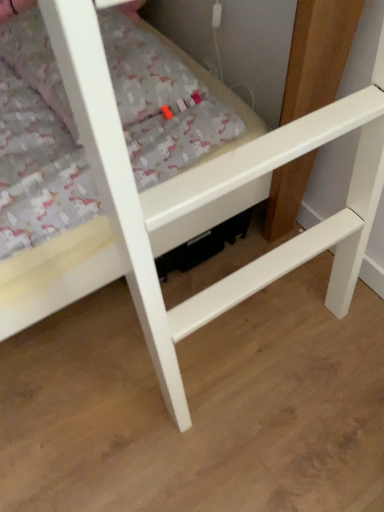
At what (x,y) coordinates should I click in order to perform the action: click on patterned fabric mattress at center. Please return your answer as a coordinate pair (x, y). Looking at the image, I should click on (37, 143).

Describe the element at coordinates (37, 143) in the screenshot. Image resolution: width=384 pixels, height=512 pixels. I see `patterned fabric mattress at center` at that location.

Measure the distance between point (62, 228) and camera.

Point (62, 228) is 34.69 inches away from camera.

This screenshot has height=512, width=384. I want to click on patterned fabric mattress at center, so click(x=37, y=143).